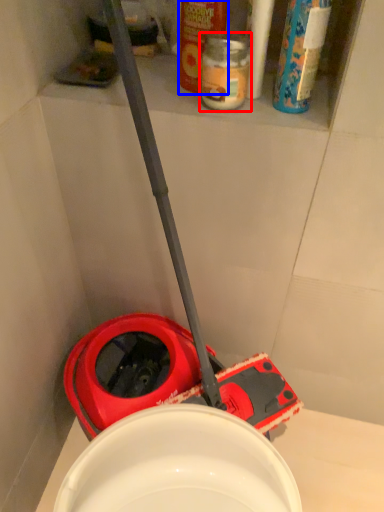
Question: Among these objects, which one is nearest to the camera, bottle (highlighted by a red box) or cleaning product (highlighted by a blue box)?

Choices:
 (A) bottle
 (B) cleaning product

Answer: (B)